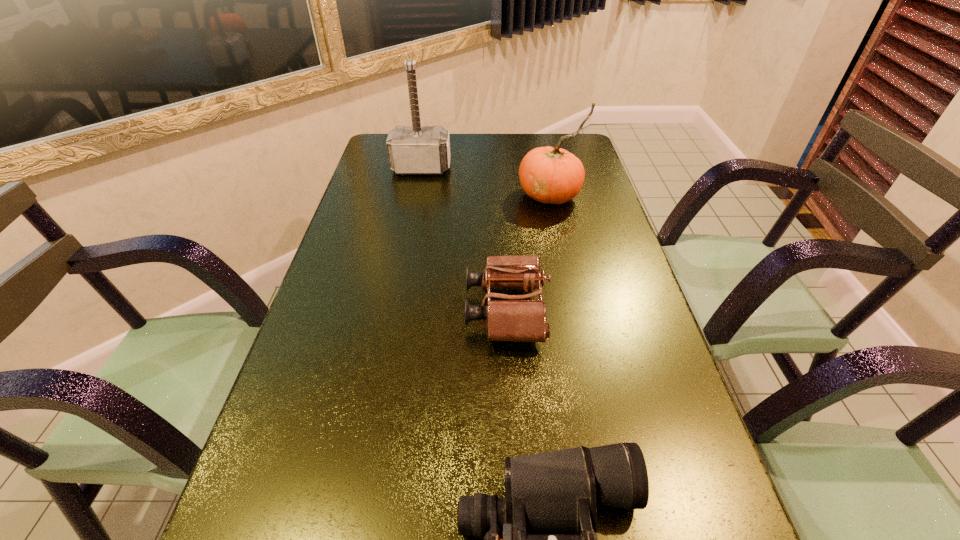
Locate an element on the screen. The height and width of the screenshot is (540, 960). blank area located 0.240m through the eyepieces of the second shortest object is located at coordinates (357, 310).

I want to click on object situated at the far edge, so click(416, 149).

The height and width of the screenshot is (540, 960). Identify the location of object at the left edge. (416, 149).

Find the location of `object that is at the right edge`. object that is at the right edge is located at coordinates (551, 175).

Where is `object that is at the far left corner`? object that is at the far left corner is located at coordinates pyautogui.click(x=416, y=149).

I want to click on vacant space at the far edge of the desktop, so (472, 144).

The image size is (960, 540). I want to click on vacant space at the left edge of the desktop, so click(x=349, y=371).

I want to click on vacant point at the right edge, so click(x=608, y=266).

Find the location of `vacant region at the far right corner`. vacant region at the far right corner is located at coordinates (547, 146).

Locate an element on the screen. The width and height of the screenshot is (960, 540). vacant area between the leftmost object and the taller binoculars is located at coordinates (464, 239).